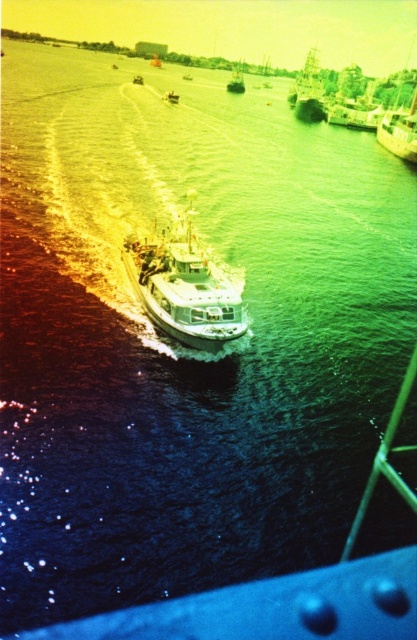
Which is behind, point (190, 202) or point (321, 118)?

Point (321, 118)

Between point (163, 268) and point (308, 113), which one is positioned in front?

Point (163, 268) is more forward.

Between point (205, 266) and point (303, 76), which one is positioned behind?

Positioned behind is point (303, 76).

Where is `white glossy boat at center`? The width and height of the screenshot is (417, 640). white glossy boat at center is located at coordinates (183, 291).

Locate an element on the screen. shiny silver boat at upper right is located at coordinates (308, 92).

Which is behind, point (293, 88) or point (238, 76)?

The point (238, 76) is more distant.

Identify the location of shiny silver boat at upper right. (308, 92).

Which is in front, point (411, 144) or point (236, 90)?

Point (411, 144)

Between metallic silver boat at upper right and metallic silver boat at center, which one appears on the right side from the viewer's perspective?

metallic silver boat at upper right

Locate an element on the screen. This screenshot has height=640, width=417. metallic silver boat at upper right is located at coordinates [x=399, y=131].

Find the location of a particular element. The height and width of the screenshot is (640, 417). metallic silver boat at upper right is located at coordinates (399, 131).